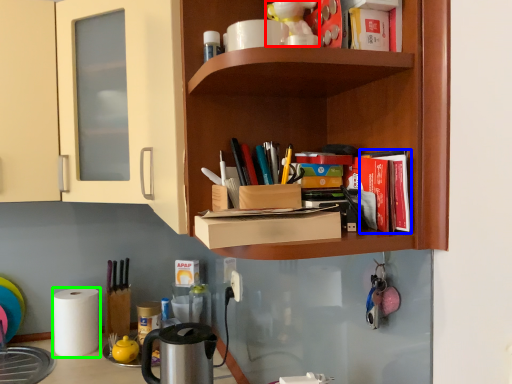
Question: Which is nearer to the toy (highlighted by a red box)? book (highlighted by a blue box) or paper towel (highlighted by a green box).

Choices:
 (A) book
 (B) paper towel

Answer: (A)